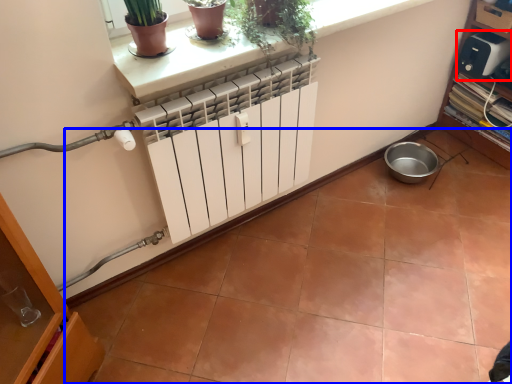
Question: Which object is closer to the camera taking this photo, appliance (highlighted by a red box) or ceramic tile (highlighted by a blue box)?

Choices:
 (A) appliance
 (B) ceramic tile

Answer: (B)